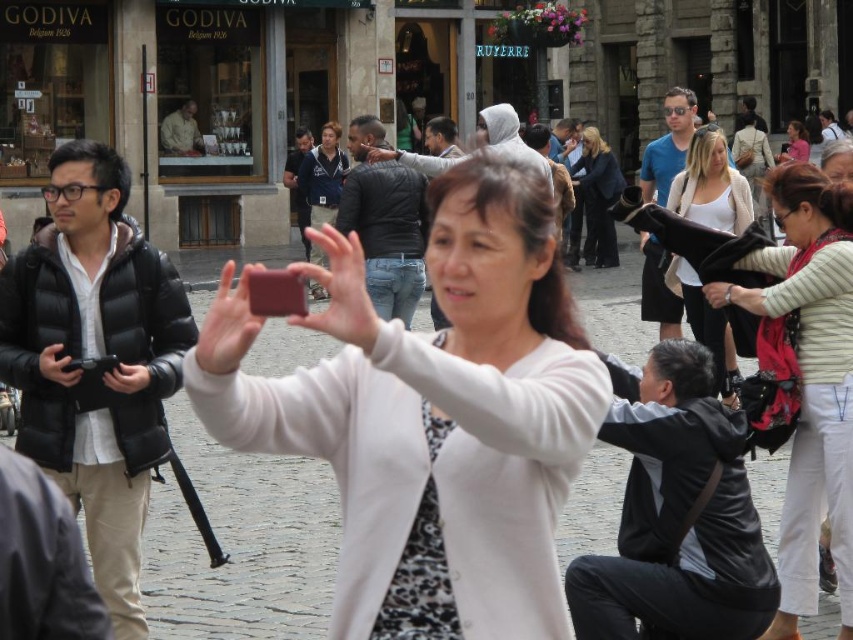
Is white matte jacket at center to the right of black matte phone at center-left from the viewer's perspective?

Correct, you'll find white matte jacket at center to the right of black matte phone at center-left.

Between point (337, 360) and point (62, 380), which one is positioned in front?

Positioned in front is point (337, 360).

Does point (451, 273) come behind point (38, 368)?

No, it is not.

Locate an element on the screen. The height and width of the screenshot is (640, 853). white matte jacket at center is located at coordinates (440, 419).

Can you confirm if matte blue jacket at center is positioned above smooth leather wallet at center?

Correct, matte blue jacket at center is located above smooth leather wallet at center.

Does matte blue jacket at center have a larger size compared to smooth leather wallet at center?

Yes.

What do you see at coordinates (323, 176) in the screenshot? I see `matte blue jacket at center` at bounding box center [323, 176].

Locate an element on the screen. The height and width of the screenshot is (640, 853). matte blue jacket at center is located at coordinates (323, 176).

Between black matte phone at center-left and pink fabric at center, which one appears on the right side from the viewer's perspective?

pink fabric at center

Does black matte phone at center-left appear over pink fabric at center?

Incorrect, black matte phone at center-left is not positioned above pink fabric at center.

Does point (61, 344) come farther from viewer compared to point (779, 154)?

No, (61, 344) is closer to viewer.

Where is `black matte phone at center-left`? black matte phone at center-left is located at coordinates (57, 365).